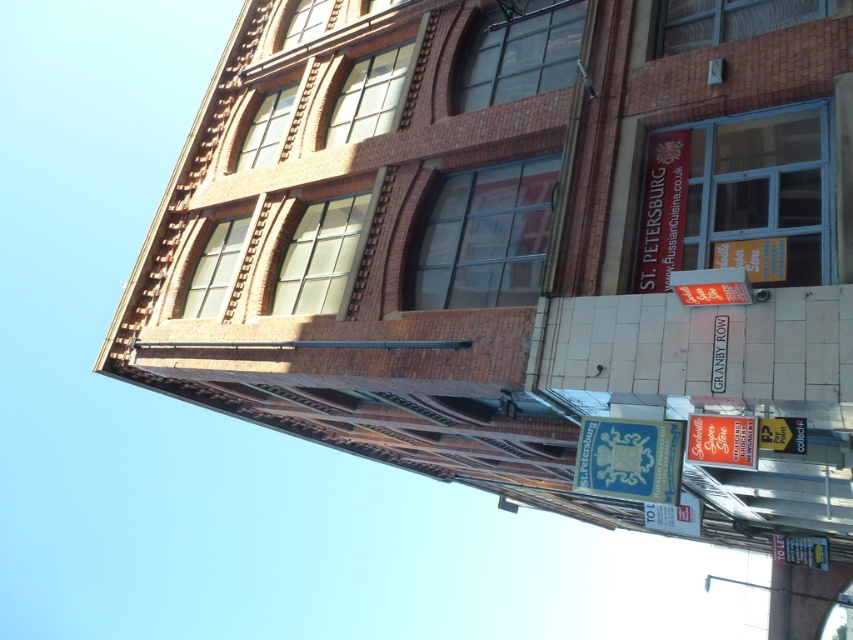
You are standing in front of the building and notice a point marked at coordinates [674,515]. Based on the scene description, what object is located at this point?

The point at coordinates [674,515] corresponds to the white plastic sign at lower center.

What is the spatial relationship between the blue paper sign at lower center and the metallic gold sign at lower right?

The blue paper sign at lower center is closer to the viewer than the metallic gold sign at lower right.

You are standing in front of the building and need to read both the matte black sign at upper right and the metallic silver sign at lower right. Which sign is closer to you?

The matte black sign at upper right is 3.10 meters away from the metallic silver sign at lower right, so the metallic silver sign at lower right is closer to you since it is positioned lower on the building and the distance between them is 3.10 meters.